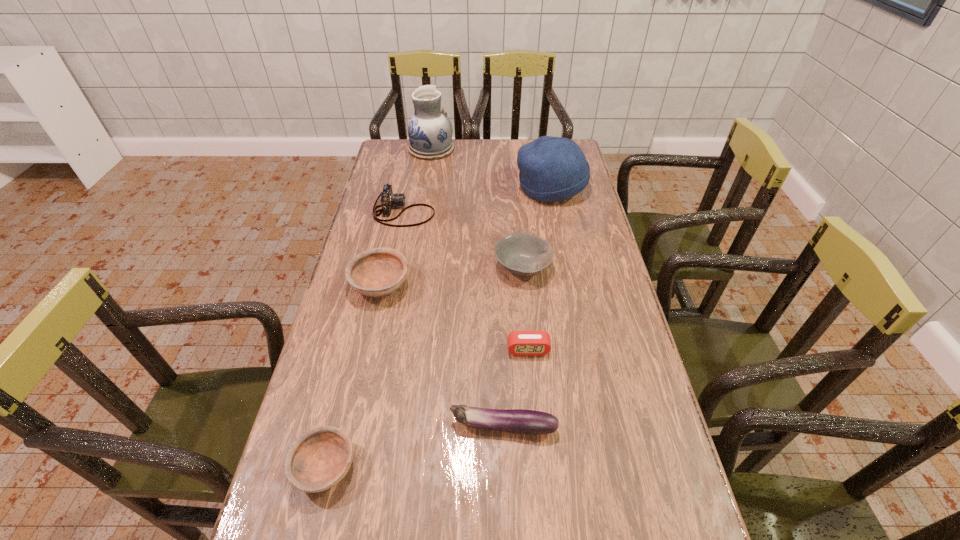
Identify the location of blank region between the eggplant and the blue pottery. (468, 288).

Locate an element on the screen. vacant region between the nearer brown bowl and the gray bowl is located at coordinates (423, 367).

This screenshot has height=540, width=960. I want to click on free space between the third nearest object and the gray bowl, so click(x=525, y=308).

Where is `free space between the brown camera and the smaller brown bowl`? free space between the brown camera and the smaller brown bowl is located at coordinates (365, 339).

Image resolution: width=960 pixels, height=540 pixels. Find the location of `vacant space that is in between the brown camera and the smaller brown bowl`. vacant space that is in between the brown camera and the smaller brown bowl is located at coordinates (365, 339).

This screenshot has width=960, height=540. Find the location of `blank region between the nearest bowl and the eggplant`. blank region between the nearest bowl and the eggplant is located at coordinates (414, 447).

I want to click on vacant area that lies between the gray bowl and the farther brown bowl, so click(x=451, y=276).

Identify which object is the second nearest to the brown camera. Please provide its 2D coordinates. Your answer should be formatted as a tuple, i.e. [(x, y)], where the tuple contains the x and y coordinates of a point satisfying the conditions above.

[(522, 254)]

The height and width of the screenshot is (540, 960). I want to click on object that is the sixth closest to the gray bowl, so click(319, 459).

Identify which bowl is located as the second nearest to the farther brown bowl. Please provide its 2D coordinates. Your answer should be formatted as a tuple, i.e. [(x, y)], where the tuple contains the x and y coordinates of a point satisfying the conditions above.

[(319, 459)]